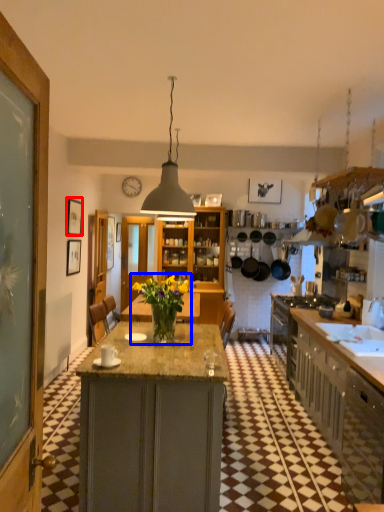
Question: Which point is further to the camera, picture frame (highlighted by a red box) or houseplant (highlighted by a blue box)?

Choices:
 (A) picture frame
 (B) houseplant

Answer: (A)